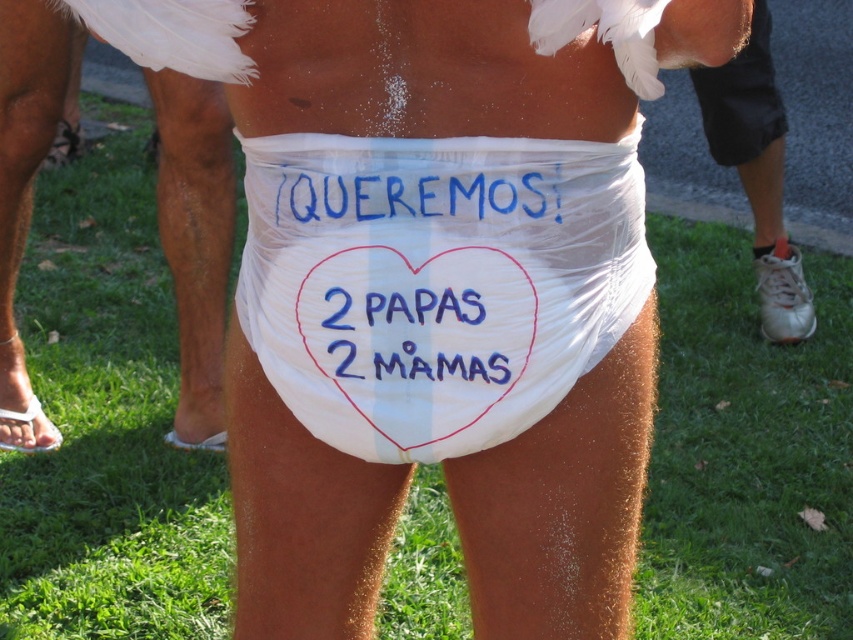
You are a photographer taking a picture of the scene. You notice the white cloth diaper at lower center and the blue fabric sign at upper center. Which object should you focus on first to ensure both are in frame and properly aligned?

The blue fabric sign at upper center is behind the white cloth diaper at lower center, so you should focus on the white cloth diaper at lower center first to ensure it stays in front and properly aligned with the sign behind it.

Based on the photo, you are a photographer setting up for a photo shoot. You have a camera with a focal length of 50mm. The subject is standing 1.58 meters away from the camera, wearing a white plastic diaper at center. To ensure the diaper is in focus, what adjustment should you make to the camera lens?

The white plastic diaper at center is 1.58 meters from the camera. To ensure it is in focus, adjust the lens focus ring to the distance marked 1.5 meters or slightly closer, as most lenses do not have precise markings for 1.58 meters. Alternatively, use auto focus mode targeting the diaper.